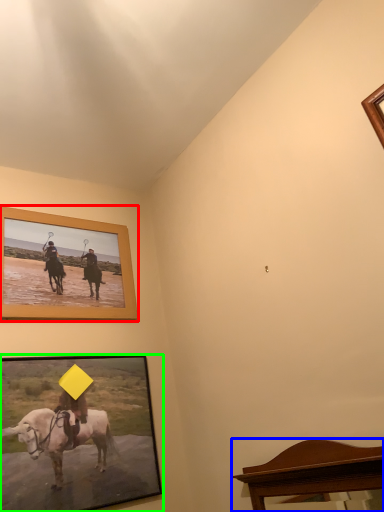
Question: Based on their relative distances, which object is nearer to picture frame (highlighted by a red box)? Choose from furniture (highlighted by a blue box) and picture frame (highlighted by a green box).

Choices:
 (A) furniture
 (B) picture frame

Answer: (B)